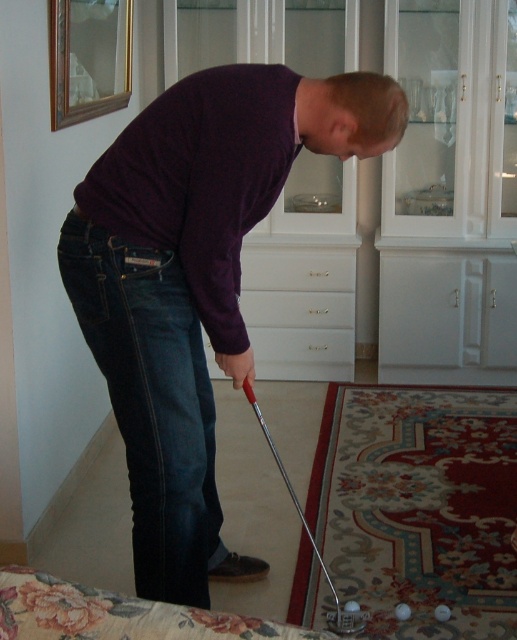
What do you see at coordinates (194, 280) in the screenshot? This screenshot has width=517, height=640. I see `purple matte sweater at center` at bounding box center [194, 280].

Does point (133, 150) lie in front of point (146, 456)?

That is True.

Locate an element on the screen. This screenshot has height=640, width=517. purple matte sweater at center is located at coordinates (194, 280).

Does point (261, 168) come farther from viewer compared to point (245, 269)?

No, (261, 168) is closer to viewer.

Is purple matte sweater at center positioned in front of white glossy drawer at center?

Yes, it is in front of white glossy drawer at center.

This screenshot has width=517, height=640. What do you see at coordinates (194, 280) in the screenshot?
I see `purple matte sweater at center` at bounding box center [194, 280].

This screenshot has width=517, height=640. I want to click on purple matte sweater at center, so click(x=194, y=280).

Between dark blue denim jeans at lower left and white glossy drawer at center, which one is positioned higher?

Positioned higher is white glossy drawer at center.

Who is positioned more to the left, dark blue denim jeans at lower left or white glossy drawer at center?

Positioned to the left is dark blue denim jeans at lower left.

Who is more distant from viewer, (x=144, y=394) or (x=301, y=285)?

The point (x=301, y=285) is more distant.

Image resolution: width=517 pixels, height=640 pixels. I want to click on dark blue denim jeans at lower left, so click(151, 403).